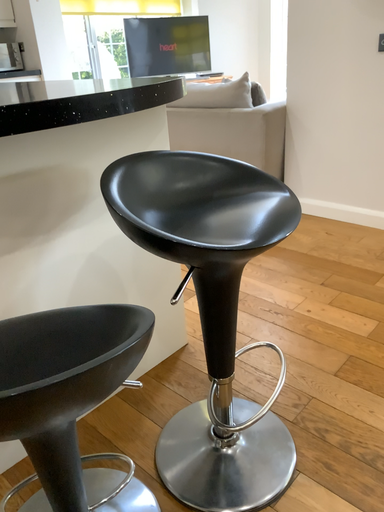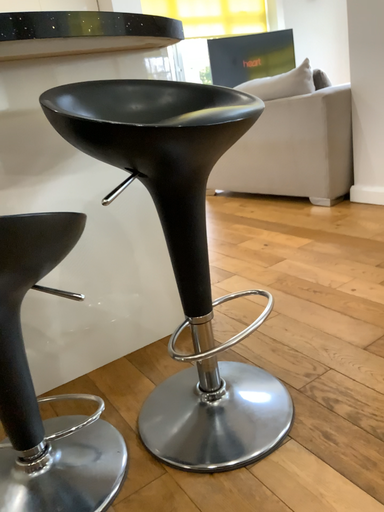
Question: How did the camera likely rotate when shooting the video?

Choices:
 (A) rotated right
 (B) rotated left

Answer: (B)